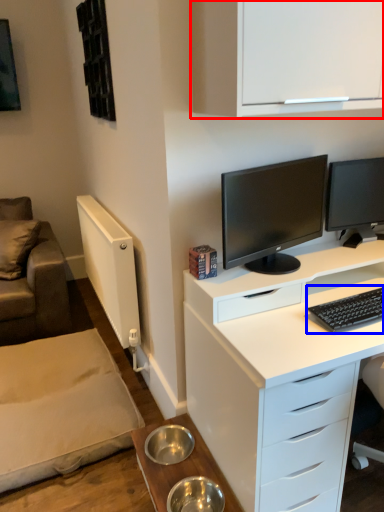
Question: Which object is further to the camera taking this photo, cabinetry (highlighted by a red box) or computer keyboard (highlighted by a blue box)?

Choices:
 (A) cabinetry
 (B) computer keyboard

Answer: (B)